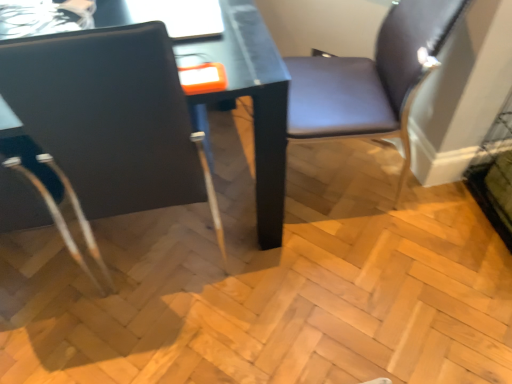
The height and width of the screenshot is (384, 512). What do you see at coordinates (371, 79) in the screenshot?
I see `purple leather chair at right, placed as the second chair when sorted from left to right` at bounding box center [371, 79].

What is the approximate height of purple leather chair at right, the first chair positioned from the right?

34.42 inches.

In order to click on purple leather chair at right, placed as the second chair when sorted from left to right in this screenshot , I will do `click(371, 79)`.

This screenshot has width=512, height=384. What are the coordinates of `matte black chair at left, placed as the 1th chair when sorted from left to right` in the screenshot? It's located at (111, 118).

What do you see at coordinates (111, 118) in the screenshot?
I see `matte black chair at left, arranged as the 2th chair when viewed from the right` at bounding box center [111, 118].

I want to click on purple leather chair at right, the first chair positioned from the right, so click(371, 79).

Which object is positioned more to the left, matte black chair at left, arranged as the 2th chair when viewed from the right, or purple leather chair at right, placed as the second chair when sorted from left to right?

Positioned to the left is matte black chair at left, arranged as the 2th chair when viewed from the right.

Considering the positions of objects matte black chair at left, arranged as the 2th chair when viewed from the right, and purple leather chair at right, the first chair positioned from the right, in the image provided, who is behind, matte black chair at left, arranged as the 2th chair when viewed from the right, or purple leather chair at right, the first chair positioned from the right,?

purple leather chair at right, the first chair positioned from the right, is further from the camera.

Does point (9, 80) come behind point (404, 66)?

That is False.

From the image's perspective, is matte black chair at left, arranged as the 2th chair when viewed from the right, above purple leather chair at right, the first chair positioned from the right?

Actually, matte black chair at left, arranged as the 2th chair when viewed from the right, appears below purple leather chair at right, the first chair positioned from the right, in the image.

From a real-world perspective, is matte black chair at left, placed as the 1th chair when sorted from left to right, positioned above or below purple leather chair at right, the first chair positioned from the right?

Clearly, from a real-world perspective, matte black chair at left, placed as the 1th chair when sorted from left to right, is above purple leather chair at right, the first chair positioned from the right.

Can you confirm if matte black chair at left, arranged as the 2th chair when viewed from the right, is wider than purple leather chair at right, the first chair positioned from the right?

Correct, the width of matte black chair at left, arranged as the 2th chair when viewed from the right, exceeds that of purple leather chair at right, the first chair positioned from the right.

Which of these two, matte black chair at left, arranged as the 2th chair when viewed from the right, or purple leather chair at right, placed as the second chair when sorted from left to right, stands taller?

matte black chair at left, arranged as the 2th chair when viewed from the right.

Considering the relative sizes of matte black chair at left, placed as the 1th chair when sorted from left to right, and purple leather chair at right, the first chair positioned from the right, in the image provided, is matte black chair at left, placed as the 1th chair when sorted from left to right, smaller than purple leather chair at right, the first chair positioned from the right,?

No, matte black chair at left, placed as the 1th chair when sorted from left to right, is not smaller than purple leather chair at right, the first chair positioned from the right.

Is purple leather chair at right, the first chair positioned from the right, surrounded by matte black chair at left, placed as the 1th chair when sorted from left to right?

Definitely not — purple leather chair at right, the first chair positioned from the right, is not inside matte black chair at left, placed as the 1th chair when sorted from left to right.

Can you see matte black chair at left, arranged as the 2th chair when viewed from the right, touching purple leather chair at right, placed as the second chair when sorted from left to right?

No, matte black chair at left, arranged as the 2th chair when viewed from the right, is not touching purple leather chair at right, placed as the second chair when sorted from left to right.

Is purple leather chair at right, the first chair positioned from the right, at the back of matte black chair at left, placed as the 1th chair when sorted from left to right?

No, matte black chair at left, placed as the 1th chair when sorted from left to right,'s orientation is not away from purple leather chair at right, the first chair positioned from the right.

How different are the orientations of matte black chair at left, arranged as the 2th chair when viewed from the right, and purple leather chair at right, the first chair positioned from the right, in degrees?

The angular difference between matte black chair at left, arranged as the 2th chair when viewed from the right, and purple leather chair at right, the first chair positioned from the right, is 83.7 degrees.

At what (x,y) coordinates should I click in order to perform the action: click on chair that is under the matte black chair at left, placed as the 1th chair when sorted from left to right (from a real-world perspective). Please return your answer as a coordinate pair (x, y). The height and width of the screenshot is (384, 512). Looking at the image, I should click on (371, 79).

Visually, is purple leather chair at right, the first chair positioned from the right, positioned to the left or to the right of matte black chair at left, placed as the 1th chair when sorted from left to right?

purple leather chair at right, the first chair positioned from the right, is to the right of matte black chair at left, placed as the 1th chair when sorted from left to right.

Which is behind, purple leather chair at right, placed as the second chair when sorted from left to right, or matte black chair at left, arranged as the 2th chair when viewed from the right?

purple leather chair at right, placed as the second chair when sorted from left to right, is behind.

Is point (407, 62) behind point (108, 200)?

Yes, point (407, 62) is behind point (108, 200).

From the image's perspective, is purple leather chair at right, placed as the second chair when sorted from left to right, above matte black chair at left, placed as the 1th chair when sorted from left to right?

Correct, purple leather chair at right, placed as the second chair when sorted from left to right, appears higher than matte black chair at left, placed as the 1th chair when sorted from left to right, in the image.

From a real-world perspective, does purple leather chair at right, the first chair positioned from the right, stand above matte black chair at left, placed as the 1th chair when sorted from left to right?

Incorrect, from a real-world perspective, purple leather chair at right, the first chair positioned from the right, is lower than matte black chair at left, placed as the 1th chair when sorted from left to right.

Looking at their sizes, would you say purple leather chair at right, placed as the second chair when sorted from left to right, is wider or thinner than matte black chair at left, arranged as the 2th chair when viewed from the right?

purple leather chair at right, placed as the second chair when sorted from left to right, is thinner than matte black chair at left, arranged as the 2th chair when viewed from the right.

Who is taller, purple leather chair at right, placed as the second chair when sorted from left to right, or matte black chair at left, placed as the 1th chair when sorted from left to right?

matte black chair at left, placed as the 1th chair when sorted from left to right.

Considering the sizes of objects purple leather chair at right, the first chair positioned from the right, and matte black chair at left, placed as the 1th chair when sorted from left to right, in the image provided, who is bigger, purple leather chair at right, the first chair positioned from the right, or matte black chair at left, placed as the 1th chair when sorted from left to right,?

matte black chair at left, placed as the 1th chair when sorted from left to right, is bigger.

Can we say purple leather chair at right, placed as the second chair when sorted from left to right, lies outside matte black chair at left, placed as the 1th chair when sorted from left to right?

Yes.

Are purple leather chair at right, the first chair positioned from the right, and matte black chair at left, arranged as the 2th chair when viewed from the right, far apart?

Actually, purple leather chair at right, the first chair positioned from the right, and matte black chair at left, arranged as the 2th chair when viewed from the right, are a little close together.

Is purple leather chair at right, placed as the second chair when sorted from left to right, turned away from matte black chair at left, placed as the 1th chair when sorted from left to right?

No.

How many degrees apart are the facing directions of purple leather chair at right, the first chair positioned from the right, and matte black chair at left, arranged as the 2th chair when viewed from the right?

There is a 83.7-degree angle between the facing directions of purple leather chair at right, the first chair positioned from the right, and matte black chair at left, arranged as the 2th chair when viewed from the right.

I want to click on chair in front of the purple leather chair at right, the first chair positioned from the right, so click(111, 118).

The width and height of the screenshot is (512, 384). In order to click on chair that appears below the matte black chair at left, placed as the 1th chair when sorted from left to right (from a real-world perspective) in this screenshot , I will do `click(371, 79)`.

In the image, there is a matte black chair at left, placed as the 1th chair when sorted from left to right. What are the coordinates of `chair above it (from the image's perspective)` in the screenshot? It's located at (371, 79).